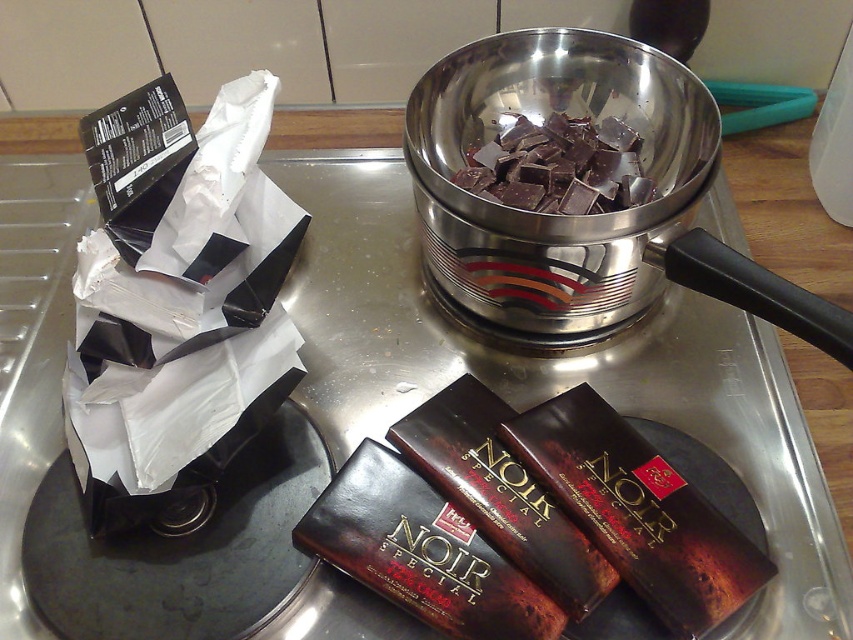
You are a chef preparing a dessert and need to choose between the dark brown glossy chocolate bar at lower center and the dark chocolate chunks at center. Which one is wider?

The dark chocolate chunks at center are wider than the dark brown glossy chocolate bar at lower center.

You are a chef preparing a dessert and need to move the dark brown glossy chocolate bar at lower center into the shiny metallic bowl at center. Given that the chef can only move the chocolate bar 7 inches, will it reach the bowl?

The shiny metallic bowl at center is 7.94 inches away from the dark brown glossy chocolate bar at lower center. Since the chef can only move the chocolate bar 7 inches, it won not reach the bowl.

You are a chef preparing a dessert and need to choose between the dark brown matte chocolate bar at lower center and the shiny dark brown chocolate bar at lower center. Which one is more visible to you from your current position?

The dark brown matte chocolate bar at lower center is more visible because the shiny dark brown chocolate bar at lower center is behind it.